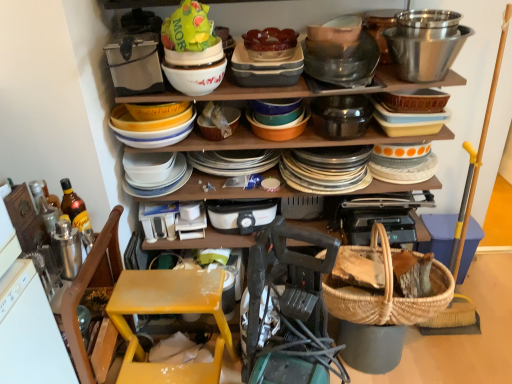
Question: Does yellow plastic step stool at lower left have a smaller size compared to polished stainless steel bowl at upper right, which is counted as the 1th bucket, starting from the right?

Choices:
 (A) yes
 (B) no

Answer: (B)

Question: Does yellow plastic step stool at lower left have a lesser height compared to polished stainless steel bowl at upper right, which is counted as the 1th bucket, starting from the right?

Choices:
 (A) yes
 (B) no

Answer: (B)

Question: Considering the relative sizes of yellow plastic step stool at lower left and polished stainless steel bowl at upper right, the second bucket viewed from the left, in the image provided, is yellow plastic step stool at lower left wider than polished stainless steel bowl at upper right, the second bucket viewed from the left,?

Choices:
 (A) yes
 (B) no

Answer: (A)

Question: Is the surface of yellow plastic step stool at lower left in direct contact with polished stainless steel bowl at upper right, which is counted as the 1th bucket, starting from the right?

Choices:
 (A) yes
 (B) no

Answer: (B)

Question: Is the depth of yellow plastic step stool at lower left less than that of polished stainless steel bowl at upper right, the second bucket viewed from the left?

Choices:
 (A) yes
 (B) no

Answer: (A)

Question: Considering their positions, is matte ceramic dishes at center located in front of or behind translucent glass bowl at upper center?

Choices:
 (A) front
 (B) behind

Answer: (B)

Question: In terms of height, does matte ceramic dishes at center look taller or shorter compared to translucent glass bowl at upper center?

Choices:
 (A) short
 (B) tall

Answer: (B)

Question: Does point (290, 129) appear closer or farther from the camera than point (291, 49)?

Choices:
 (A) closer
 (B) farther

Answer: (B)

Question: Would you say matte ceramic dishes at center is inside or outside translucent glass bowl at upper center?

Choices:
 (A) outside
 (B) inside

Answer: (A)

Question: Does point (199, 304) appear closer or farther from the camera than point (448, 236)?

Choices:
 (A) farther
 (B) closer

Answer: (B)

Question: Looking at their shapes, would you say yellow plastic step stool at lower left is wider or thinner than woven wicker basket at lower right?

Choices:
 (A) wide
 (B) thin

Answer: (A)

Question: Which is correct: yellow plastic step stool at lower left is inside woven wicker basket at lower right, or outside of it?

Choices:
 (A) inside
 (B) outside

Answer: (B)

Question: In terms of size, does yellow plastic step stool at lower left appear bigger or smaller than woven wicker basket at lower right?

Choices:
 (A) small
 (B) big

Answer: (B)

Question: Does point (229, 107) appear closer or farther from the camera than point (68, 192)?

Choices:
 (A) closer
 (B) farther

Answer: (B)

Question: Is woven straw basket at center, which appears as the 1th basket when viewed from the front, spatially inside translucent amber glass bottle at left, or outside of it?

Choices:
 (A) inside
 (B) outside

Answer: (B)